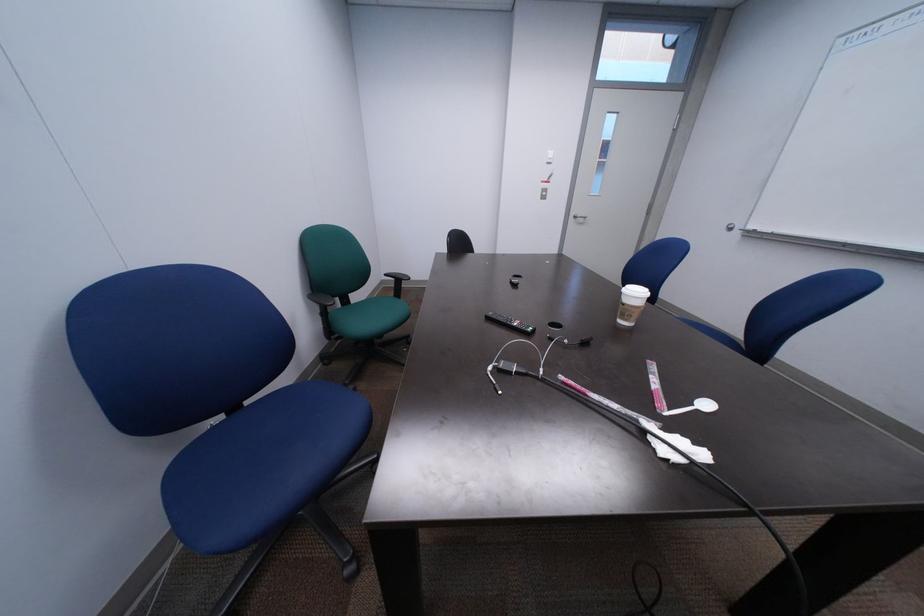
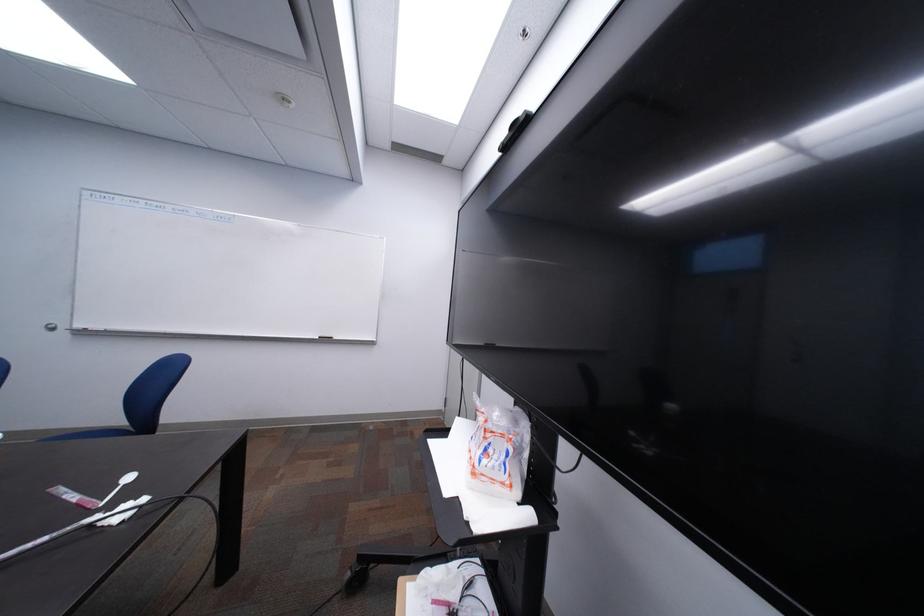
Question: The first image is from the beginning of the video and the second image is from the end. How did the camera likely rotate when shooting the video?

Choices:
 (A) Left
 (B) Right
 (C) Up
 (D) Down

Answer: (B)